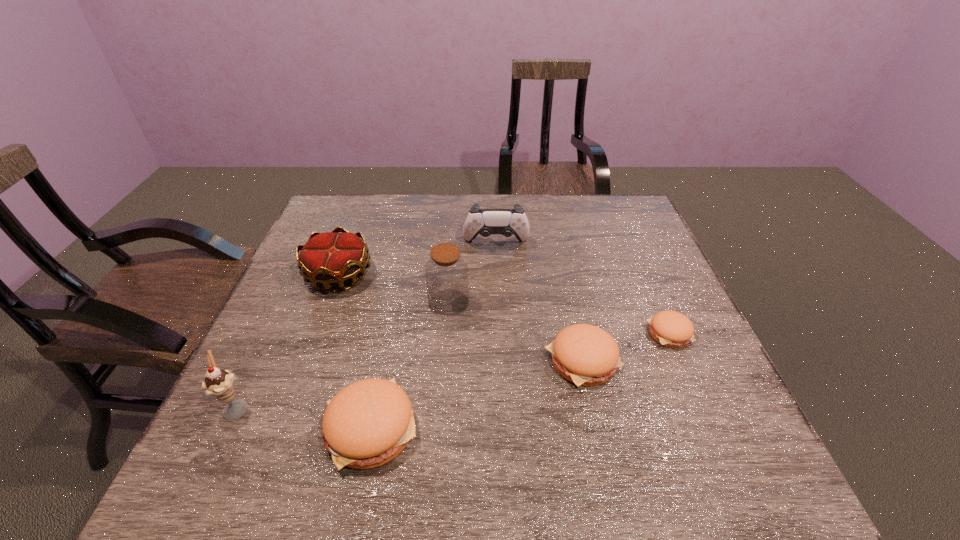
You are a GUI agent. You are given a task and a screenshot of the screen. Output one action in this format:
    pyautogui.click(x=<x>, y=<y>)
    Task: Click on the leftmost patty
    This screenshot has width=960, height=540.
    Given the screenshot: What is the action you would take?
    pyautogui.click(x=368, y=423)

At what (x,y) coordinates should I click in order to perform the action: click on the second tallest patty. Please return your answer as a coordinate pair (x, y). Looking at the image, I should click on (584, 354).

Find the location of a particular element. The width and height of the screenshot is (960, 540). the sixth tallest object is located at coordinates (584, 354).

Image resolution: width=960 pixels, height=540 pixels. In order to click on the shortest patty in this screenshot , I will do `click(672, 329)`.

Identify the location of the rightmost object. (672, 329).

Where is `crown`? The image size is (960, 540). crown is located at coordinates (331, 258).

You are a GUI agent. You are given a task and a screenshot of the screen. Output one action in this format:
    pyautogui.click(x=<x>, y=<y>)
    Task: Click on the fifth shortest object
    The width and height of the screenshot is (960, 540).
    Given the screenshot: What is the action you would take?
    pyautogui.click(x=485, y=222)

Image resolution: width=960 pixels, height=540 pixels. Find the location of `control`. control is located at coordinates (x=485, y=222).

The image size is (960, 540). Identify the location of jar. (446, 271).

At what (x,y) coordinates should I click in order to perform the action: click on icecream. Please return your answer as a coordinate pair (x, y). Looking at the image, I should click on (219, 383).